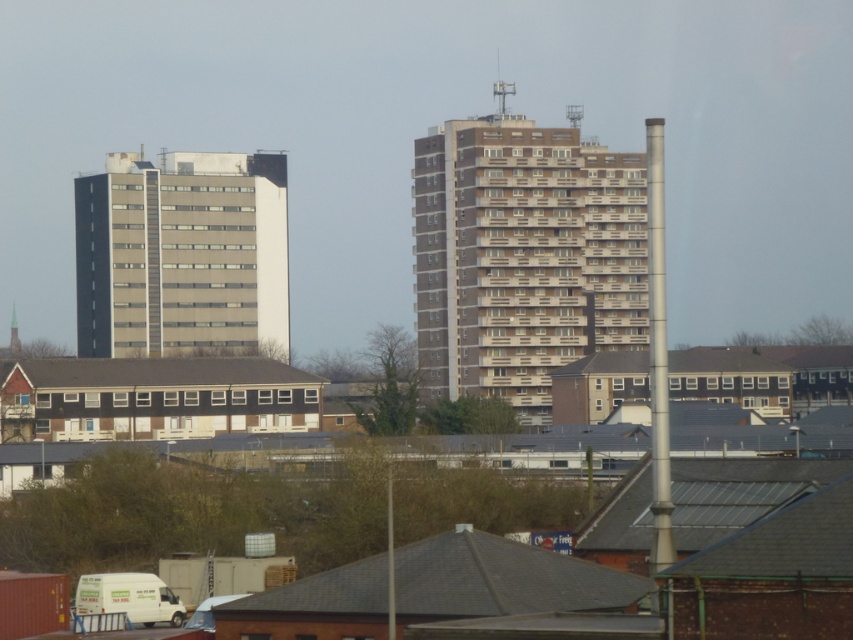
You are a delivery drone with a wingspan of 1.8 meters. You need to fly between the brown concrete building at center and the beige concrete building at left to deliver a package. Can you safely pass through the gap between them?

The gap between the brown concrete building at center and the beige concrete building at left is 20.16 meters, which is significantly wider than the drone wingspan of 1.8 meters. Yes, the drone can safely pass through the gap between them.

You are an architect analyzing the urban layout. Based on the scene, which of the two buildings, the brown concrete building at center or the beige concrete building at left, is positioned lower in the image?

The brown concrete building at center is positioned lower in the image than the beige concrete building at left.

You are a city planner evaluating the urban layout. Based on the scene, which of the two buildings, the brown concrete building at center or the beige concrete building at left, would require more space for construction due to its size?

The brown concrete building at center has a larger size compared to the beige concrete building at left, so it would require more space for construction.